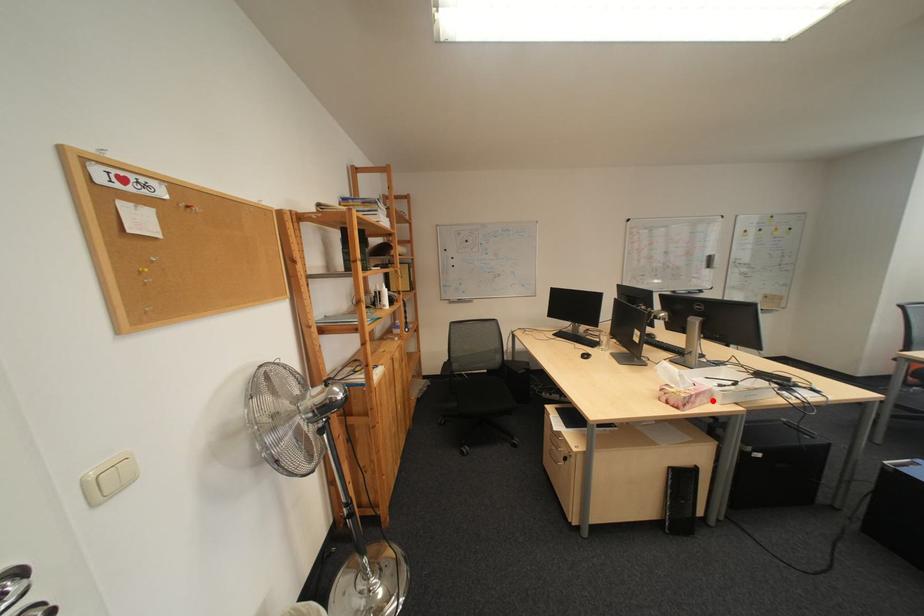
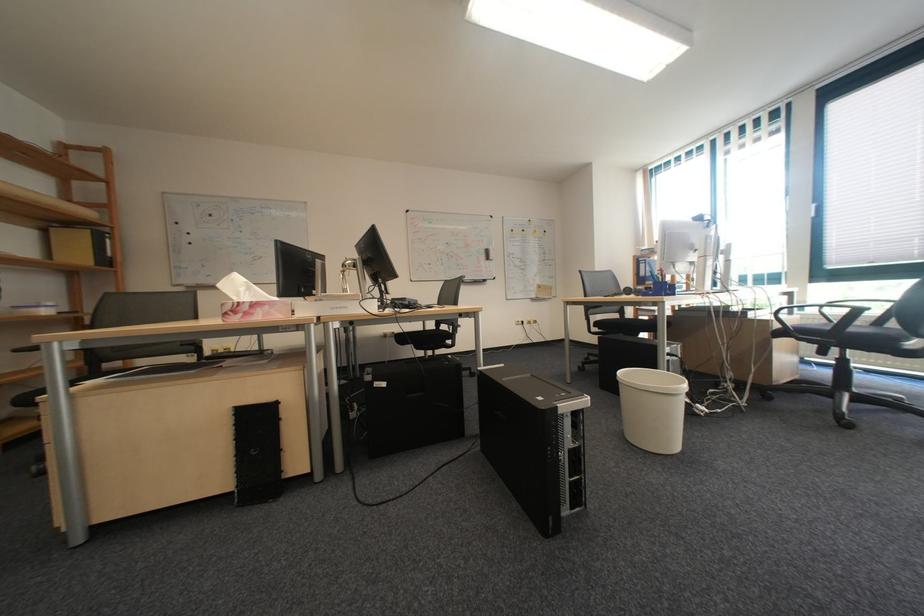
Question: I am providing you with two images of the same scene from different viewpoints. A red point is marked on the first image. Can you still see the location of the red point in image 2?

Choices:
 (A) Yes
 (B) No

Answer: (A)